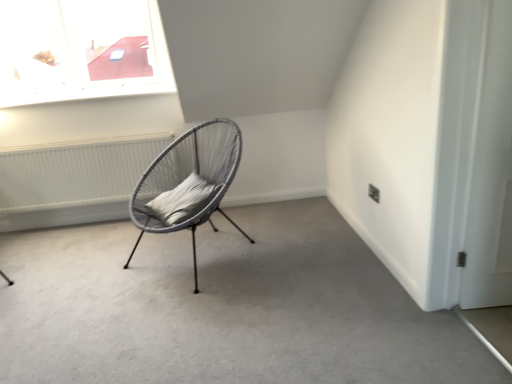
Question: Does gray fabric pillow at center have a lesser width compared to matte gray chair at center?

Choices:
 (A) no
 (B) yes

Answer: (B)

Question: Would you say matte gray chair at center is part of gray fabric pillow at center's contents?

Choices:
 (A) yes
 (B) no

Answer: (B)

Question: From the image's perspective, is gray fabric pillow at center beneath matte gray chair at center?

Choices:
 (A) yes
 (B) no

Answer: (B)

Question: Can you confirm if gray fabric pillow at center is shorter than matte gray chair at center?

Choices:
 (A) yes
 (B) no

Answer: (B)

Question: Can you confirm if gray fabric pillow at center is smaller than matte gray chair at center?

Choices:
 (A) yes
 (B) no

Answer: (A)

Question: Is matte grey wicker chair at center bigger or smaller than white matte door at right?

Choices:
 (A) big
 (B) small

Answer: (A)

Question: Choose the correct answer: Is matte grey wicker chair at center inside white matte door at right or outside it?

Choices:
 (A) outside
 (B) inside

Answer: (A)

Question: Is matte grey wicker chair at center taller or shorter than white matte door at right?

Choices:
 (A) short
 (B) tall

Answer: (A)

Question: From the image's perspective, is matte grey wicker chair at center positioned above or below white matte door at right?

Choices:
 (A) below
 (B) above

Answer: (A)

Question: Considering the relative positions of white textured radiator at left and matte grey wicker chair at center in the image provided, is white textured radiator at left to the left or to the right of matte grey wicker chair at center?

Choices:
 (A) left
 (B) right

Answer: (A)

Question: Relative to matte grey wicker chair at center, is white textured radiator at left in front or behind?

Choices:
 (A) behind
 (B) front

Answer: (A)

Question: Considering the positions of white textured radiator at left and matte grey wicker chair at center in the image, is white textured radiator at left wider or thinner than matte grey wicker chair at center?

Choices:
 (A) thin
 (B) wide

Answer: (A)

Question: From the image's perspective, is white textured radiator at left above or below matte grey wicker chair at center?

Choices:
 (A) above
 (B) below

Answer: (A)

Question: In the image, is white matte door at right positioned in front of or behind matte grey wicker chair at center?

Choices:
 (A) front
 (B) behind

Answer: (A)

Question: Based on their sizes in the image, would you say white matte door at right is bigger or smaller than matte grey wicker chair at center?

Choices:
 (A) big
 (B) small

Answer: (B)